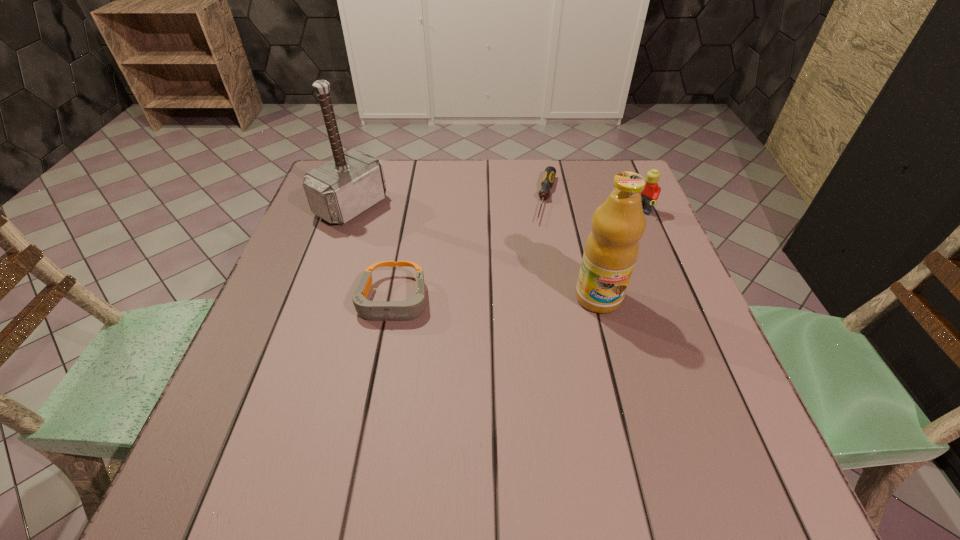
What are the coordinates of `the second shortest object` in the screenshot? It's located at (412, 308).

Find the location of a particular element. The height and width of the screenshot is (540, 960). olive oil is located at coordinates (611, 250).

At what (x,y) coordinates should I click in order to perform the action: click on screwdriver. Please return your answer as a coordinate pair (x, y). The width and height of the screenshot is (960, 540). Looking at the image, I should click on (547, 182).

You are a GUI agent. You are given a task and a screenshot of the screen. Output one action in this format:
    pyautogui.click(x=<x>, y=<y>)
    Task: Click on the hammer
    This screenshot has height=540, width=960.
    Given the screenshot: What is the action you would take?
    pyautogui.click(x=341, y=189)

The width and height of the screenshot is (960, 540). Identify the location of the rightmost object. (651, 192).

In order to click on the third tallest object in this screenshot , I will do `click(651, 192)`.

In order to click on blank area located 0.090m on the front and back of the second shortest object in this screenshot , I will do `click(380, 369)`.

Locate an element on the screen. free space located 0.200m on the label of the olive oil is located at coordinates (625, 402).

Identify the location of free point located 0.050m insert the shortest object into a screw head. (544, 237).

What are the coordinates of `vacant area located insert the shortest object into a screw head` in the screenshot? It's located at (544, 239).